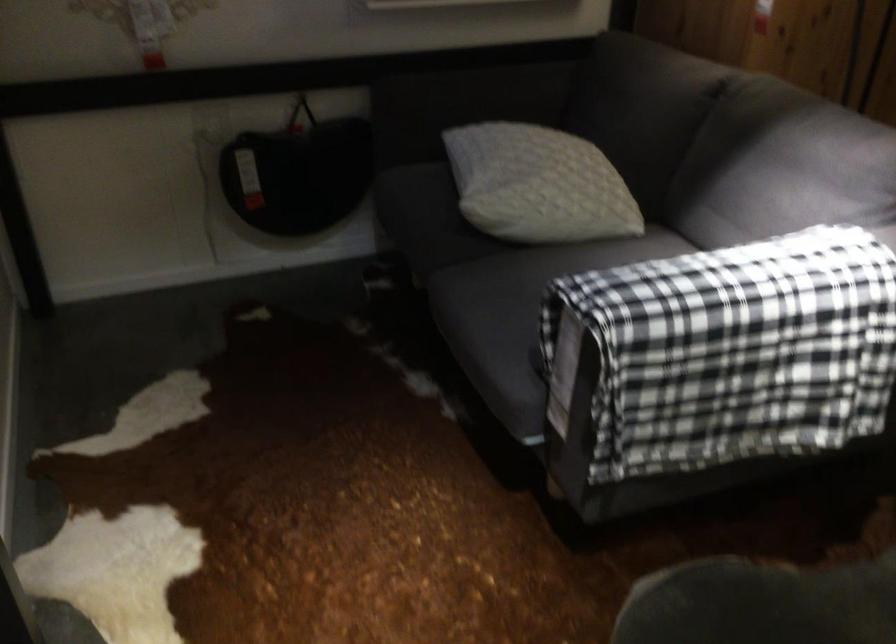
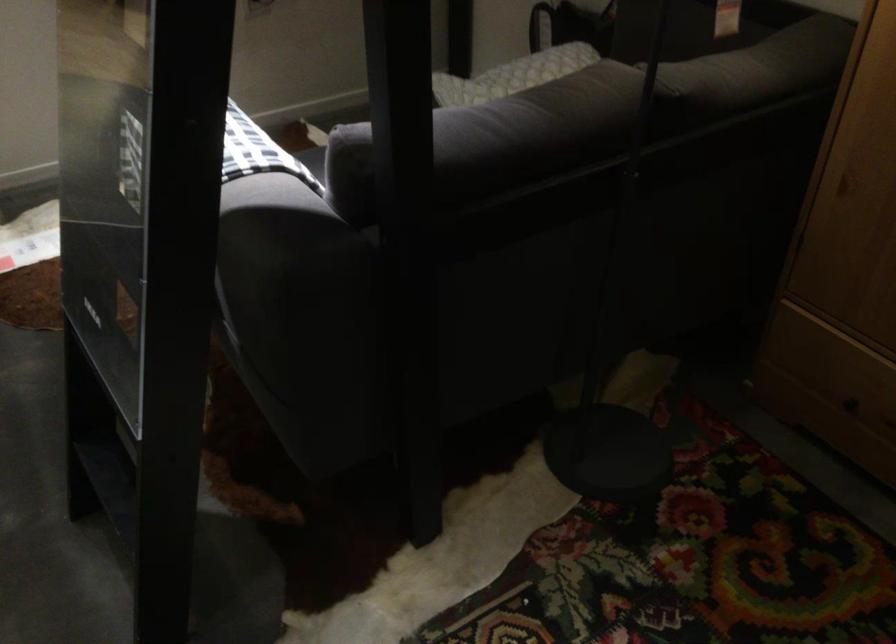
Question: I am providing you with two images of the same scene from different viewpoints. Which of the following objects are not visible in image2?

Choices:
 (A) patterned cushion
 (B) plaid throw blanket
 (C) white power switch
 (D) sofa armrest

Answer: (B)